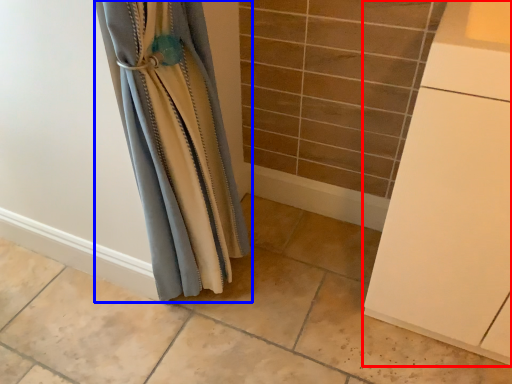
Question: Which object is closer to the camera taking this photo, cabinetry (highlighted by a red box) or curtain (highlighted by a blue box)?

Choices:
 (A) cabinetry
 (B) curtain

Answer: (A)